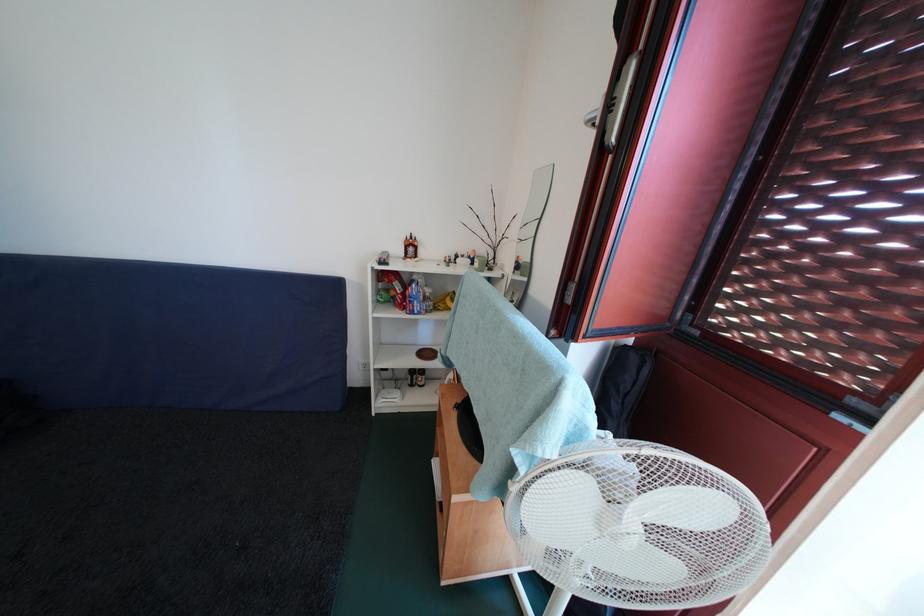
The height and width of the screenshot is (616, 924). Find the location of `yellow banana`. yellow banana is located at coordinates (444, 301).